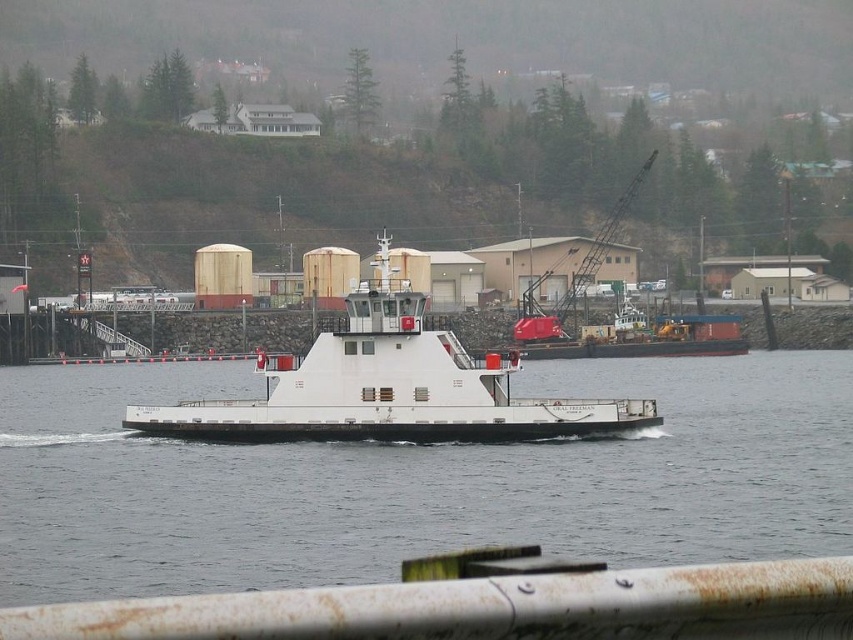
You are standing on the shore and looking at the white matte water at center and the white matte boat at center. Which object is nearer to you?

The white matte water at center is closer to the viewer than the white matte boat at center.

You are a marine biologist studying water conditions. You need to collect a water sample from the white matte water at center. Based on the ferry boat WRAJ FREEMAN and the surrounding coastal scene, where would you position your boat to safely collect the sample without obstructing the ferry?

The white matte water at center is located at point (416, 481). To safely collect the sample without obstructing the ferry WRAJ FREEMAN, position your boat away from the ferry and the coastal structures, ensuring you are in an open area of the water.